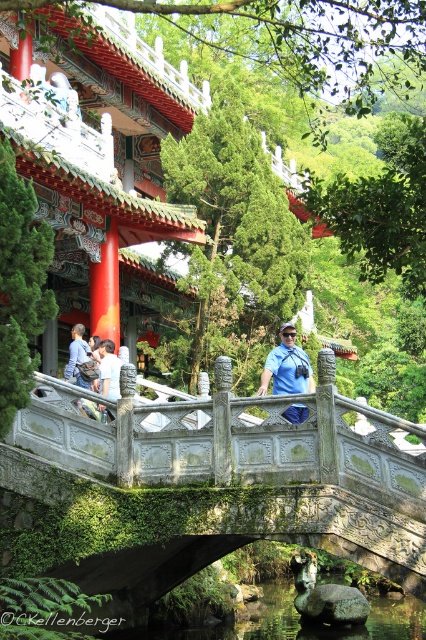
You are standing on the stone bridge and see the clear water at bridge center and the blue fabric shirt at center. Which object is located to the left of the other?

The blue fabric shirt at center is located to the left of the clear water at bridge center because the clear water at bridge center is positioned on the right side of blue fabric shirt at center.

You are standing on the stone bridge at the center of the image. Looking around, you notice a point marked at coordinates [210,484]. Based on the scene description, can you identify what this point corresponds to?

The point at coordinates [210,484] corresponds to the green mossy stone bridge at center, as indicated in the objects description.